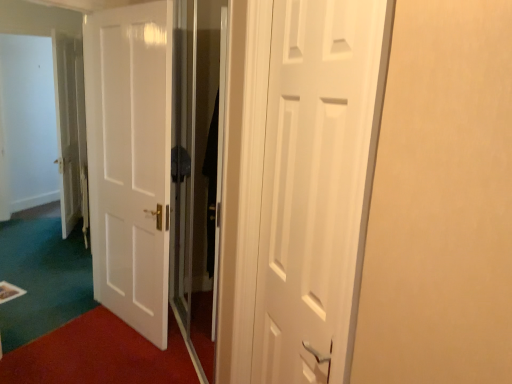
The width and height of the screenshot is (512, 384). What do you see at coordinates (130, 161) in the screenshot?
I see `white glossy door at center, the 2th door positioned from the right` at bounding box center [130, 161].

Measure the distance between point [284,341] and camera.

The distance of point [284,341] from camera is 4.42 feet.

Identify the location of white matte door at center, the first door positioned from the front. The width and height of the screenshot is (512, 384). (317, 184).

What are the coordinates of `transparent glass screen door at center` in the screenshot? It's located at [x=196, y=172].

Who is smaller, transparent glass screen door at center or white glossy door at center, positioned as the 2th door in front-to-back order?

Smaller between the two is white glossy door at center, positioned as the 2th door in front-to-back order.

Would you consider transparent glass screen door at center to be distant from white glossy door at center, positioned as the 2th door in front-to-back order?

transparent glass screen door at center is near white glossy door at center, positioned as the 2th door in front-to-back order, not far away.

What's the angular difference between transparent glass screen door at center and white glossy door at center, the 2th door positioned from the right,'s facing directions?

There is a 33.8-degree angle between the facing directions of transparent glass screen door at center and white glossy door at center, the 2th door positioned from the right.

Is transparent glass screen door at center at the right side of white glossy door at center, positioned as the 2th door in front-to-back order?

Correct, you'll find transparent glass screen door at center to the right of white glossy door at center, positioned as the 2th door in front-to-back order.

Considering the positions of objects white matte door at center, which appears as the second door when viewed from the back, and white glossy door at center, the 2th door positioned from the right, in the image provided, who is more to the right, white matte door at center, which appears as the second door when viewed from the back, or white glossy door at center, the 2th door positioned from the right,?

Positioned to the right is white matte door at center, which appears as the second door when viewed from the back.

Considering the sizes of objects white matte door at center, the first door positioned from the front, and white glossy door at center, positioned as the 2th door in front-to-back order, in the image provided, who is taller, white matte door at center, the first door positioned from the front, or white glossy door at center, positioned as the 2th door in front-to-back order,?

white glossy door at center, positioned as the 2th door in front-to-back order.

Find the location of a particular element. This screenshot has height=384, width=512. door lying on the left of white matte door at center, the first door positioned from the front is located at coordinates pos(130,161).

From the image's perspective, is white glossy door at center, positioned as the 2th door in front-to-back order, positioned above or below transparent glass screen door at center?

Clearly, from the image's perspective, white glossy door at center, positioned as the 2th door in front-to-back order, is above transparent glass screen door at center.

Is white glossy door at center, the 2th door positioned from the right, at the right side of transparent glass screen door at center?

No.

Is white glossy door at center, marked as the 1th door in a left-to-right arrangement, facing towards transparent glass screen door at center?

No, white glossy door at center, marked as the 1th door in a left-to-right arrangement, is not oriented towards transparent glass screen door at center.

Does white glossy door at center, positioned as the 2th door in front-to-back order, have a lesser height compared to transparent glass screen door at center?

Indeed, white glossy door at center, positioned as the 2th door in front-to-back order, has a lesser height compared to transparent glass screen door at center.

Considering the relative sizes of white glossy door at center, the 2th door positioned from the right, and white matte door at center, the 2th door viewed from the left, in the image provided, is white glossy door at center, the 2th door positioned from the right, taller than white matte door at center, the 2th door viewed from the left,?

Yes, white glossy door at center, the 2th door positioned from the right, is taller than white matte door at center, the 2th door viewed from the left.

Considering the sizes of white glossy door at center, which appears as the first door when viewed from the back, and white matte door at center, the first door positioned from the front, in the image, is white glossy door at center, which appears as the first door when viewed from the back, wider or thinner than white matte door at center, the first door positioned from the front,?

white glossy door at center, which appears as the first door when viewed from the back, is wider than white matte door at center, the first door positioned from the front.

Is white glossy door at center, positioned as the 2th door in front-to-back order, facing towards white matte door at center, which appears as the second door when viewed from the back?

No, white glossy door at center, positioned as the 2th door in front-to-back order, is not turned towards white matte door at center, which appears as the second door when viewed from the back.

Is white matte door at center, marked as the first door in a right-to-left arrangement, surrounded by white glossy door at center, positioned as the 2th door in front-to-back order?

Actually, white matte door at center, marked as the first door in a right-to-left arrangement, is outside white glossy door at center, positioned as the 2th door in front-to-back order.

Does white matte door at center, the first door positioned from the front, appear on the right side of transparent glass screen door at center?

Correct, you'll find white matte door at center, the first door positioned from the front, to the right of transparent glass screen door at center.

Is white matte door at center, which appears as the second door when viewed from the back, wider than transparent glass screen door at center?

Indeed, white matte door at center, which appears as the second door when viewed from the back, has a greater width compared to transparent glass screen door at center.

Between white matte door at center, the first door positioned from the front, and transparent glass screen door at center, which one has less height?

white matte door at center, the first door positioned from the front, is shorter.

Is point (177, 102) closer or farther from the camera than point (313, 34)?

Point (177, 102) is farther from the camera than point (313, 34).

Measure the distance between transparent glass screen door at center and white matte door at center, the 2th door viewed from the left.

They are 4.08 feet apart.

Is transparent glass screen door at center completely or partially outside of white matte door at center, which appears as the second door when viewed from the back?

Yes, transparent glass screen door at center is located beyond the bounds of white matte door at center, which appears as the second door when viewed from the back.

From the image's perspective, which one is positioned lower, transparent glass screen door at center or white matte door at center, the 2th door viewed from the left?

white matte door at center, the 2th door viewed from the left.

This screenshot has width=512, height=384. Identify the location of door above the transparent glass screen door at center (from the image's perspective). (130, 161).

Find the location of `door below the white matte door at center, the first door positioned from the front (from a real-world perspective)`. door below the white matte door at center, the first door positioned from the front (from a real-world perspective) is located at coordinates (130, 161).

Considering their positions, is white glossy door at center, the 2th door positioned from the right, positioned further to transparent glass screen door at center than white matte door at center, which appears as the second door when viewed from the back?

white matte door at center, which appears as the second door when viewed from the back.

Considering their positions, is white matte door at center, the first door positioned from the front, positioned closer to white glossy door at center, marked as the 1th door in a left-to-right arrangement, than transparent glass screen door at center?

transparent glass screen door at center is closer to white glossy door at center, marked as the 1th door in a left-to-right arrangement.

From the image, which object appears to be farther from white glossy door at center, which appears as the first door when viewed from the back, transparent glass screen door at center or white matte door at center, marked as the first door in a right-to-left arrangement?

white matte door at center, marked as the first door in a right-to-left arrangement.

In the scene shown: When comparing their distances from transparent glass screen door at center, does white matte door at center, marked as the first door in a right-to-left arrangement, or white glossy door at center, positioned as the 2th door in front-to-back order, seem further?

white matte door at center, marked as the first door in a right-to-left arrangement.

When comparing their distances from white matte door at center, the 2th door viewed from the left, does transparent glass screen door at center or white glossy door at center, marked as the 1th door in a left-to-right arrangement, seem closer?

transparent glass screen door at center is positioned closer to the anchor white matte door at center, the 2th door viewed from the left.

When comparing their distances from white matte door at center, which appears as the second door when viewed from the back, does white glossy door at center, the 2th door positioned from the right, or transparent glass screen door at center seem further?

Among the two, white glossy door at center, the 2th door positioned from the right, is located further to white matte door at center, which appears as the second door when viewed from the back.

Where is `screen door positioned between white matte door at center, the first door positioned from the front, and white glossy door at center, which appears as the first door when viewed from the back, from near to far`? This screenshot has height=384, width=512. screen door positioned between white matte door at center, the first door positioned from the front, and white glossy door at center, which appears as the first door when viewed from the back, from near to far is located at coordinates (196, 172).